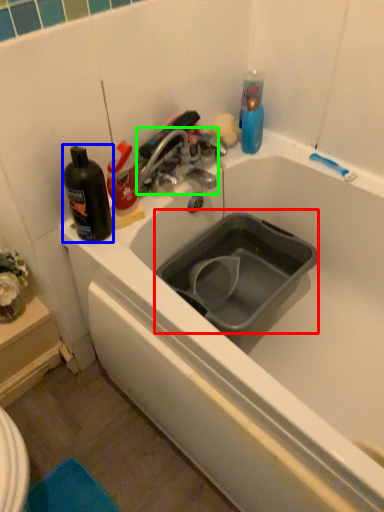
Question: Considering the real-world distances, which object is farthest from sink (highlighted by a red box)? bottle (highlighted by a blue box) or tap (highlighted by a green box)?

Choices:
 (A) bottle
 (B) tap

Answer: (A)